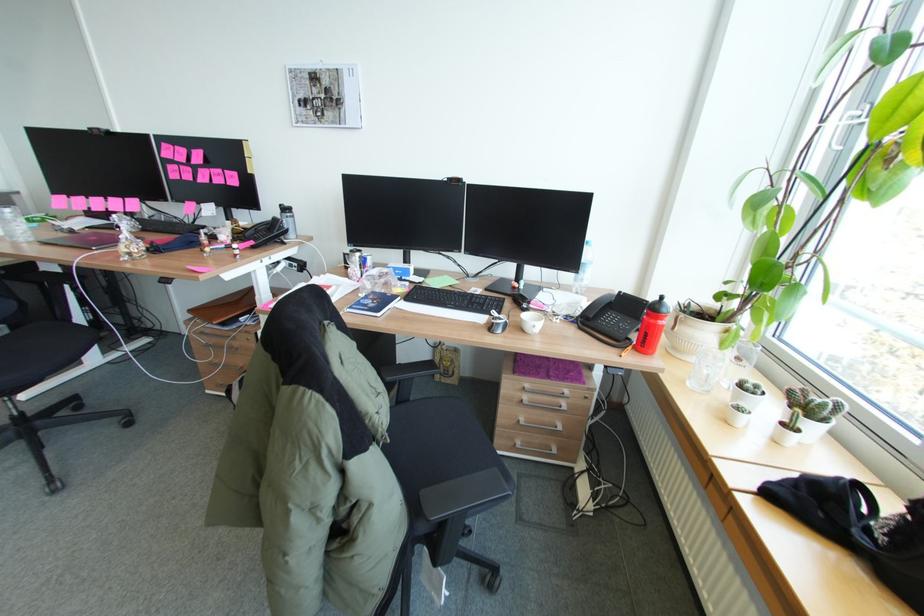
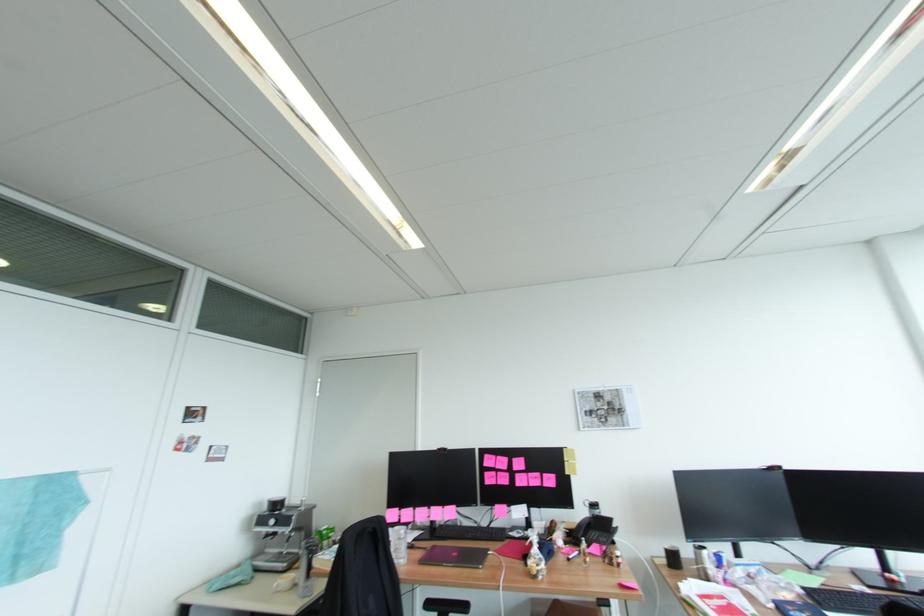
The point at (x=261, y=238) is marked in the first image. Where is the corresponding point in the second image?

(603, 541)